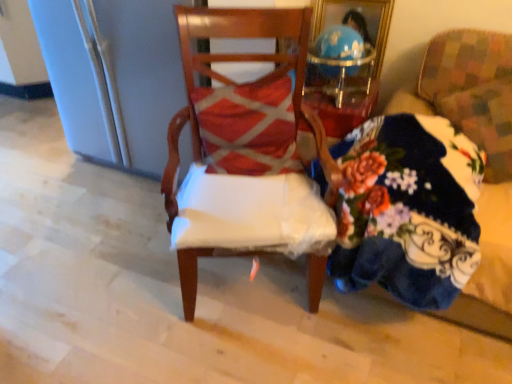
Question: Is wooden chair at center, the second chair from the right, not near floral-patterned fabric at right, which is the second chair from left to right?

Choices:
 (A) yes
 (B) no

Answer: (B)

Question: Considering the relative positions of wooden chair at center, the second chair from the right, and floral-patterned fabric at right, the first chair when ordered from right to left, in the image provided, is wooden chair at center, the second chair from the right, to the right of floral-patterned fabric at right, the first chair when ordered from right to left, from the viewer's perspective?

Choices:
 (A) yes
 (B) no

Answer: (B)

Question: Does wooden chair at center, the second chair from the right, have a larger size compared to floral-patterned fabric at right, which is the second chair from left to right?

Choices:
 (A) yes
 (B) no

Answer: (A)

Question: Can you confirm if wooden chair at center, the first chair from the left, is smaller than floral-patterned fabric at right, which is the second chair from left to right?

Choices:
 (A) yes
 (B) no

Answer: (B)

Question: Does wooden chair at center, the first chair from the left, touch floral-patterned fabric at right, which is the second chair from left to right?

Choices:
 (A) no
 (B) yes

Answer: (A)

Question: Would you say wooden chair at center, the first chair from the left, is to the left or to the right of floral fabric couch at right in the picture?

Choices:
 (A) left
 (B) right

Answer: (A)

Question: In the image, is wooden chair at center, the first chair from the left, positioned in front of or behind floral fabric couch at right?

Choices:
 (A) front
 (B) behind

Answer: (B)

Question: From a real-world perspective, is wooden chair at center, the first chair from the left, positioned above or below floral fabric couch at right?

Choices:
 (A) above
 (B) below

Answer: (A)

Question: Is point (183, 314) closer or farther from the camera than point (409, 221)?

Choices:
 (A) farther
 (B) closer

Answer: (A)

Question: Relative to wooden chair at center, the second chair from the right, is floral fabric couch at right in front or behind?

Choices:
 (A) behind
 (B) front

Answer: (B)

Question: Does point (437, 152) appear closer or farther from the camera than point (201, 185)?

Choices:
 (A) closer
 (B) farther

Answer: (A)

Question: Considering the positions of floral fabric couch at right and wooden chair at center, the first chair from the left, in the image, is floral fabric couch at right taller or shorter than wooden chair at center, the first chair from the left,?

Choices:
 (A) tall
 (B) short

Answer: (B)

Question: Do you think floral fabric couch at right is within wooden chair at center, the second chair from the right, or outside of it?

Choices:
 (A) inside
 (B) outside

Answer: (B)

Question: Is floral-patterned fabric at right, the first chair when ordered from right to left, wider or thinner than wooden chair at center, the first chair from the left?

Choices:
 (A) thin
 (B) wide

Answer: (A)

Question: From a real-world perspective, is floral-patterned fabric at right, the first chair when ordered from right to left, positioned above or below wooden chair at center, the first chair from the left?

Choices:
 (A) above
 (B) below

Answer: (A)